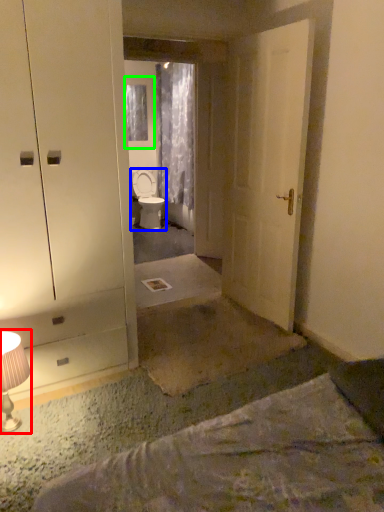
Question: Which object is the farthest from table lamp (highlighted by a red box)? Choose among these: toilet (highlighted by a blue box) or window (highlighted by a green box).

Choices:
 (A) toilet
 (B) window

Answer: (B)